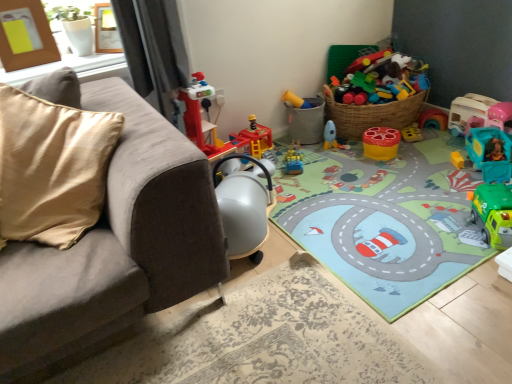
Where is `vacant space in between teal plastic toy car at right, placed as the second toy when sorted from right to left, and shiny yellow plastic train at center, placed as the 6th toy when sorted from right to left`? This screenshot has height=384, width=512. vacant space in between teal plastic toy car at right, placed as the second toy when sorted from right to left, and shiny yellow plastic train at center, placed as the 6th toy when sorted from right to left is located at coordinates (376, 164).